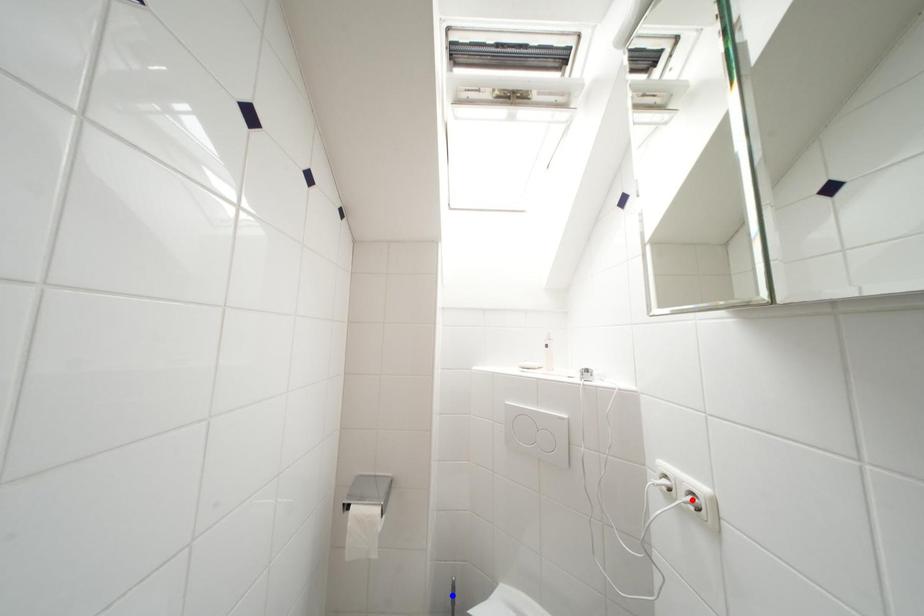
Question: In the image, two points are highlighted. Which point is nearer to the camera? Reply with the corresponding letter.

Choices:
 (A) blue point
 (B) red point

Answer: (B)